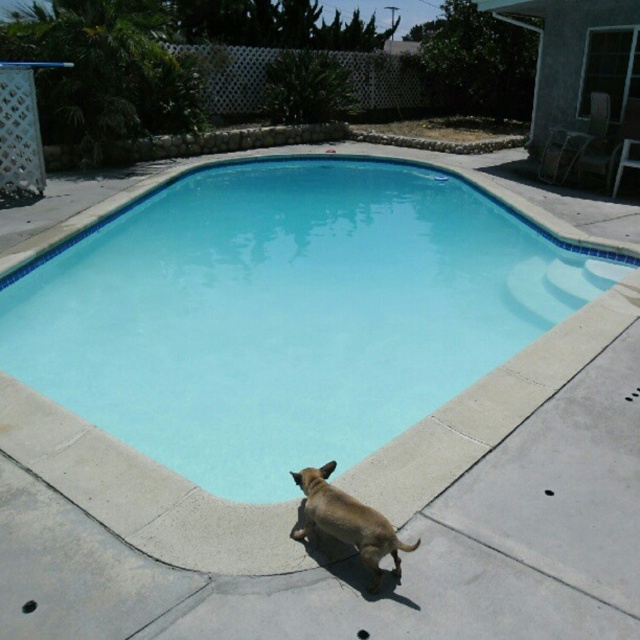
Question: Among these points, which one is farthest from the camera?

Choices:
 (A) (284, 358)
 (B) (300, 531)

Answer: (A)

Question: Can you confirm if blue smooth pool at center is thinner than brown matte dog at lower center?

Choices:
 (A) yes
 (B) no

Answer: (B)

Question: Does blue smooth pool at center have a larger size compared to brown matte dog at lower center?

Choices:
 (A) no
 (B) yes

Answer: (B)

Question: Is blue smooth pool at center wider than brown matte dog at lower center?

Choices:
 (A) yes
 (B) no

Answer: (A)

Question: Among these points, which one is nearest to the camera?

Choices:
 (A) (316, 486)
 (B) (292, 308)

Answer: (A)